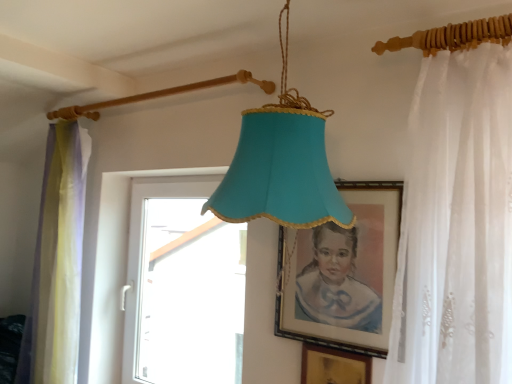
What do you see at coordinates (334, 366) in the screenshot? I see `gold metallic picture frame at lower center, the 1th picture frame ordered from the bottom` at bounding box center [334, 366].

Image resolution: width=512 pixels, height=384 pixels. Find the location of `gold metallic picture frame at lower center, the 1th picture frame ordered from the bottom`. gold metallic picture frame at lower center, the 1th picture frame ordered from the bottom is located at coordinates (334, 366).

Image resolution: width=512 pixels, height=384 pixels. In order to click on white sheer curtain at right, marked as the second curtain in a back-to-front arrangement in this screenshot , I will do `click(456, 224)`.

The height and width of the screenshot is (384, 512). In order to click on white plastic window at center in this screenshot , I will do `click(189, 295)`.

From the image's perspective, is translucent yellowish-green curtain at left, arranged as the second curtain when viewed from the front, on top of matte gold picture frame at center, the 1th picture frame when ordered from top to bottom?

No.

Consider the image. Is translucent yellowish-green curtain at left, which is counted as the first curtain, starting from the back, wider than matte gold picture frame at center, which ranks as the second picture frame in bottom-to-top order?

Correct, the width of translucent yellowish-green curtain at left, which is counted as the first curtain, starting from the back, exceeds that of matte gold picture frame at center, which ranks as the second picture frame in bottom-to-top order.

From a real-world perspective, is translucent yellowish-green curtain at left, arranged as the second curtain when viewed from the front, positioned above or below matte gold picture frame at center, the 1th picture frame when ordered from top to bottom?

From a real-world perspective, translucent yellowish-green curtain at left, arranged as the second curtain when viewed from the front, is physically below matte gold picture frame at center, the 1th picture frame when ordered from top to bottom.

Is translucent yellowish-green curtain at left, which is counted as the first curtain, starting from the back, turned away from matte gold picture frame at center, the 1th picture frame when ordered from top to bottom?

No, translucent yellowish-green curtain at left, which is counted as the first curtain, starting from the back, is not facing the opposite direction of matte gold picture frame at center, the 1th picture frame when ordered from top to bottom.

Which of these two, translucent yellowish-green curtain at left, which ranks as the second curtain in right-to-left order, or white plastic window at center, is bigger?

white plastic window at center.

Between translucent yellowish-green curtain at left, which is counted as the first curtain, starting from the back, and white plastic window at center, which one is positioned in front?

white plastic window at center is closer to the camera.

Is translucent yellowish-green curtain at left, which is counted as the first curtain, starting from the back, taller than white plastic window at center?

Yes.

Is there a large distance between translucent yellowish-green curtain at left, arranged as the second curtain when viewed from the front, and white plastic window at center?

No, translucent yellowish-green curtain at left, arranged as the second curtain when viewed from the front, is not far from white plastic window at center.

Measure the distance between white sheer curtain at right, marked as the second curtain in a back-to-front arrangement, and matte gold picture frame at center, which ranks as the second picture frame in bottom-to-top order.

white sheer curtain at right, marked as the second curtain in a back-to-front arrangement, is 10.39 inches away from matte gold picture frame at center, which ranks as the second picture frame in bottom-to-top order.

From the image's perspective, is white sheer curtain at right, marked as the second curtain in a back-to-front arrangement, located above or below matte gold picture frame at center, which ranks as the second picture frame in bottom-to-top order?

Based on their image positions, white sheer curtain at right, marked as the second curtain in a back-to-front arrangement, is located above matte gold picture frame at center, which ranks as the second picture frame in bottom-to-top order.

In the image, is white sheer curtain at right, the first curtain viewed from the right, positioned in front of or behind matte gold picture frame at center, the 1th picture frame when ordered from top to bottom?

In the image, white sheer curtain at right, the first curtain viewed from the right, appears in front of matte gold picture frame at center, the 1th picture frame when ordered from top to bottom.

Is gold metallic picture frame at lower center, marked as the 2th picture frame in a top-to-bottom arrangement, not inside white sheer curtain at right, marked as the second curtain in a left-to-right arrangement?

Answer: That's correct, gold metallic picture frame at lower center, marked as the 2th picture frame in a top-to-bottom arrangement, is outside of white sheer curtain at right, marked as the second curtain in a left-to-right arrangement.

What's the angular difference between gold metallic picture frame at lower center, the 1th picture frame ordered from the bottom, and white sheer curtain at right, marked as the second curtain in a left-to-right arrangement,'s facing directions?

They differ by 0.00138 degrees in their facing directions.

Based on the photo, from a real-world perspective, is gold metallic picture frame at lower center, marked as the 2th picture frame in a top-to-bottom arrangement, on top of white sheer curtain at right, marked as the second curtain in a back-to-front arrangement?

No, from a real-world perspective, gold metallic picture frame at lower center, marked as the 2th picture frame in a top-to-bottom arrangement, is not over white sheer curtain at right, marked as the second curtain in a back-to-front arrangement

From the image's perspective, which one is positioned lower, gold metallic picture frame at lower center, the 1th picture frame ordered from the bottom, or white sheer curtain at right, the first curtain viewed from the right?

gold metallic picture frame at lower center, the 1th picture frame ordered from the bottom, is shown below in the image.

Choose the correct answer: Is translucent yellowish-green curtain at left, which ranks as the second curtain in right-to-left order, inside gold metallic picture frame at lower center, marked as the 2th picture frame in a top-to-bottom arrangement, or outside it?

translucent yellowish-green curtain at left, which ranks as the second curtain in right-to-left order, is spatially situated outside gold metallic picture frame at lower center, marked as the 2th picture frame in a top-to-bottom arrangement.

Between translucent yellowish-green curtain at left, arranged as the second curtain when viewed from the front, and gold metallic picture frame at lower center, marked as the 2th picture frame in a top-to-bottom arrangement, which one has larger size?

With larger size is translucent yellowish-green curtain at left, arranged as the second curtain when viewed from the front.

Would you say translucent yellowish-green curtain at left, which ranks as the second curtain in right-to-left order, is a long distance from gold metallic picture frame at lower center, the 1th picture frame ordered from the bottom?

Absolutely, translucent yellowish-green curtain at left, which ranks as the second curtain in right-to-left order, is distant from gold metallic picture frame at lower center, the 1th picture frame ordered from the bottom.

Find the location of a particular element. The image size is (512, 384). picture frame that is the 1st object located in front of the translucent yellowish-green curtain at left, arranged as the second curtain when viewed from the front is located at coordinates (334, 366).

Between white sheer curtain at right, the first curtain viewed from the right, and translucent yellowish-green curtain at left, which ranks as the second curtain in right-to-left order, which one appears on the right side from the viewer's perspective?

white sheer curtain at right, the first curtain viewed from the right.

Is white sheer curtain at right, which appears as the 1th curtain when viewed from the front, located outside translucent yellowish-green curtain at left, which is counted as the first curtain, starting from the back?

Yes, white sheer curtain at right, which appears as the 1th curtain when viewed from the front, is outside of translucent yellowish-green curtain at left, which is counted as the first curtain, starting from the back.

Based on the photo, could you measure the distance between white sheer curtain at right, which appears as the 1th curtain when viewed from the front, and translucent yellowish-green curtain at left, which is counted as the first curtain, starting from the back?

The distance of white sheer curtain at right, which appears as the 1th curtain when viewed from the front, from translucent yellowish-green curtain at left, which is counted as the first curtain, starting from the back, is 1.52 meters.

From the picture: Is white sheer curtain at right, marked as the second curtain in a back-to-front arrangement, with translucent yellowish-green curtain at left, arranged as the second curtain when viewed from the front?

No, white sheer curtain at right, marked as the second curtain in a back-to-front arrangement, is not making contact with translucent yellowish-green curtain at left, arranged as the second curtain when viewed from the front.

Is white plastic window at center in contact with gold metallic picture frame at lower center, marked as the 2th picture frame in a top-to-bottom arrangement?

No, white plastic window at center is not making contact with gold metallic picture frame at lower center, marked as the 2th picture frame in a top-to-bottom arrangement.

Consider the image. Can we say white plastic window at center lies outside gold metallic picture frame at lower center, marked as the 2th picture frame in a top-to-bottom arrangement?

Yes, white plastic window at center is outside of gold metallic picture frame at lower center, marked as the 2th picture frame in a top-to-bottom arrangement.

Find the location of a particular element. The height and width of the screenshot is (384, 512). curtain behind the matte gold picture frame at center, the 1th picture frame when ordered from top to bottom is located at coordinates (56, 265).

At what (x,y) coordinates should I click in order to perform the action: click on window on the right of translucent yellowish-green curtain at left, which is counted as the first curtain, starting from the back. Please return your answer as a coordinate pair (x, y). Looking at the image, I should click on (189, 295).

Looking at the image, which one is located further to translucent yellowish-green curtain at left, the 1th curtain in the left-to-right sequence, white plastic window at center or gold metallic picture frame at lower center, the 1th picture frame ordered from the bottom?

The object further to translucent yellowish-green curtain at left, the 1th curtain in the left-to-right sequence, is gold metallic picture frame at lower center, the 1th picture frame ordered from the bottom.

Based on their spatial positions, is gold metallic picture frame at lower center, marked as the 2th picture frame in a top-to-bottom arrangement, or white plastic window at center closer to matte gold picture frame at center, the 1th picture frame when ordered from top to bottom?

gold metallic picture frame at lower center, marked as the 2th picture frame in a top-to-bottom arrangement.

From the image, which object appears to be nearer to white plastic window at center, matte gold picture frame at center, the 1th picture frame when ordered from top to bottom, or translucent yellowish-green curtain at left, the 1th curtain in the left-to-right sequence?

translucent yellowish-green curtain at left, the 1th curtain in the left-to-right sequence, is positioned closer to the anchor white plastic window at center.

From the image, which object appears to be farther from matte gold picture frame at center, the 1th picture frame when ordered from top to bottom, gold metallic picture frame at lower center, marked as the 2th picture frame in a top-to-bottom arrangement, or white sheer curtain at right, the first curtain viewed from the right?

white sheer curtain at right, the first curtain viewed from the right, lies further to matte gold picture frame at center, the 1th picture frame when ordered from top to bottom, than the other object.

In the scene shown: Looking at the image, which one is located further to gold metallic picture frame at lower center, marked as the 2th picture frame in a top-to-bottom arrangement, matte gold picture frame at center, the 1th picture frame when ordered from top to bottom, or translucent yellowish-green curtain at left, the 1th curtain in the left-to-right sequence?

translucent yellowish-green curtain at left, the 1th curtain in the left-to-right sequence, lies further to gold metallic picture frame at lower center, marked as the 2th picture frame in a top-to-bottom arrangement, than the other object.

From the image, which object appears to be nearer to white plastic window at center, white sheer curtain at right, the first curtain viewed from the right, or translucent yellowish-green curtain at left, the 1th curtain in the left-to-right sequence?

translucent yellowish-green curtain at left, the 1th curtain in the left-to-right sequence, lies closer to white plastic window at center than the other object.

Which object lies further to the anchor point white sheer curtain at right, which appears as the 1th curtain when viewed from the front, white plastic window at center or matte gold picture frame at center, the 1th picture frame when ordered from top to bottom?

white plastic window at center.

From the image, which object appears to be nearer to translucent yellowish-green curtain at left, the 1th curtain in the left-to-right sequence, white sheer curtain at right, which appears as the 1th curtain when viewed from the front, or white plastic window at center?

white plastic window at center.

Identify the location of picture frame between translucent yellowish-green curtain at left, which ranks as the second curtain in right-to-left order, and matte gold picture frame at center, the 1th picture frame when ordered from top to bottom, in the horizontal direction. This screenshot has height=384, width=512. (334, 366).

Identify the location of picture frame between white sheer curtain at right, marked as the second curtain in a left-to-right arrangement, and gold metallic picture frame at lower center, the 1th picture frame ordered from the bottom, from top to bottom. (342, 274).

You are a GUI agent. You are given a task and a screenshot of the screen. Output one action in this format:
    pyautogui.click(x=<x>, y=<y>)
    Task: Click on the window situated between translucent yellowish-green curtain at left, the 1th curtain in the left-to-right sequence, and white sheer curtain at right, marked as the second curtain in a back-to-front arrangement, from left to right
    The width and height of the screenshot is (512, 384).
    Given the screenshot: What is the action you would take?
    pyautogui.click(x=189, y=295)

This screenshot has height=384, width=512. I want to click on picture frame situated between white plastic window at center and matte gold picture frame at center, the 1th picture frame when ordered from top to bottom, from left to right, so click(334, 366).